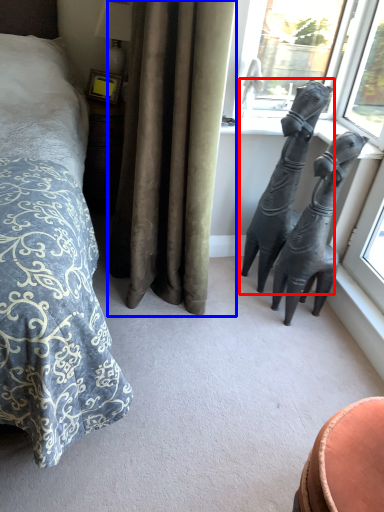
Question: Which point is closer to the camera, statue (sculpture) (highlighted by a red box) or curtain (highlighted by a blue box)?

Choices:
 (A) statue (sculpture)
 (B) curtain

Answer: (B)